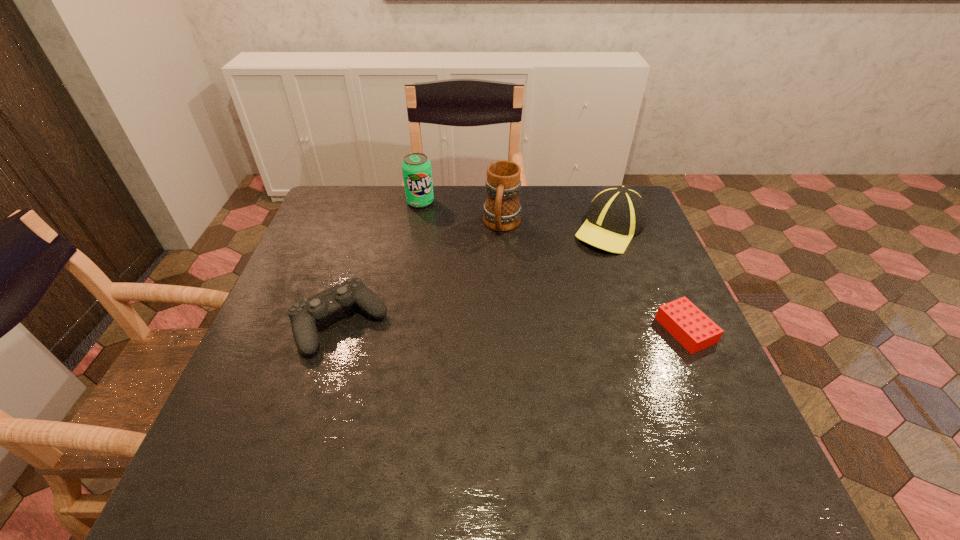
Find the location of `Lego that is at the right edge`. Lego that is at the right edge is located at coordinates (695, 331).

Locate an element on the screen. baseball cap located in the right edge section of the desktop is located at coordinates (616, 214).

Find the location of a particular element. object that is at the far right corner is located at coordinates (616, 214).

Identify the location of free spot at the far edge of the desktop. The height and width of the screenshot is (540, 960). (459, 192).

You are a GUI agent. You are given a task and a screenshot of the screen. Output one action in this format:
    pyautogui.click(x=<x>, y=<y>)
    Task: Click on the vacant space at the near edge of the desktop
    This screenshot has height=540, width=960.
    Given the screenshot: What is the action you would take?
    pyautogui.click(x=318, y=400)

The height and width of the screenshot is (540, 960). Identify the location of free space at the left edge. (314, 387).

The width and height of the screenshot is (960, 540). Find the location of `free space at the right edge of the desktop`. free space at the right edge of the desktop is located at coordinates (671, 289).

Locate an element on the screen. free location at the near left corner is located at coordinates (237, 413).

Image resolution: width=960 pixels, height=540 pixels. Identify the location of free space between the third shortest object and the third object from right to left. (556, 227).

The image size is (960, 540). Identify the location of vacant region between the fourth shortest object and the Lego. (553, 266).